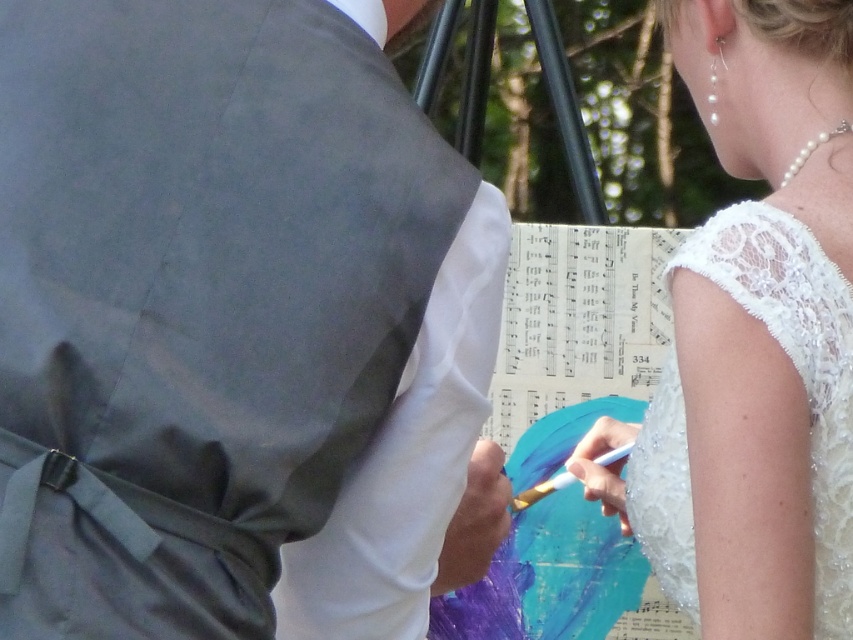
You are organizing a gallery event and need to display two artworks. The first artwork is the matte gray vest at center, and the second is the white lace dress at upper right. Since space is limited, you need to know which artwork requires more horizontal space. Which one should be placed in a wider area?

The matte gray vest at center requires more horizontal space because its width is larger than that of the white lace dress at upper right.

You are an observer standing in front of the scene. You see the matte gray vest at center and the white lace dress at upper right. Which object is higher in position?

The matte gray vest at center is above the white lace dress at upper right, so it is higher in position.

From the picture: You are a photographer trying to capture a candid shot of the matte gray vest at center and the white lace dress at upper right. The camera has a maximum focus range of 50 centimeters. Can you take a photo that clearly shows both subjects without moving the camera?

The matte gray vest at center is 49.33 centimeters away from the white lace dress at upper right. Since the distance between them is within the camera s 50 centimeter focus range, you can take a photo that clearly shows both subjects without moving the camera.